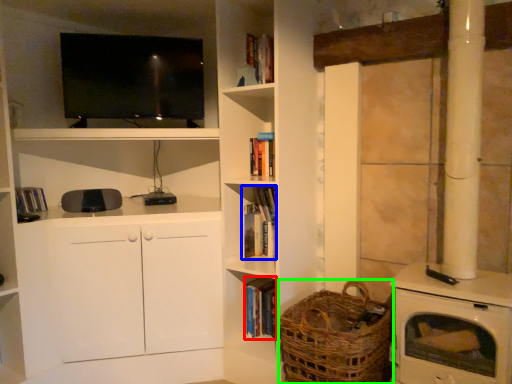
Question: Which is farther away from book (highlighted by a red box)? book (highlighted by a blue box) or basket (highlighted by a green box)?

Choices:
 (A) book
 (B) basket

Answer: (B)